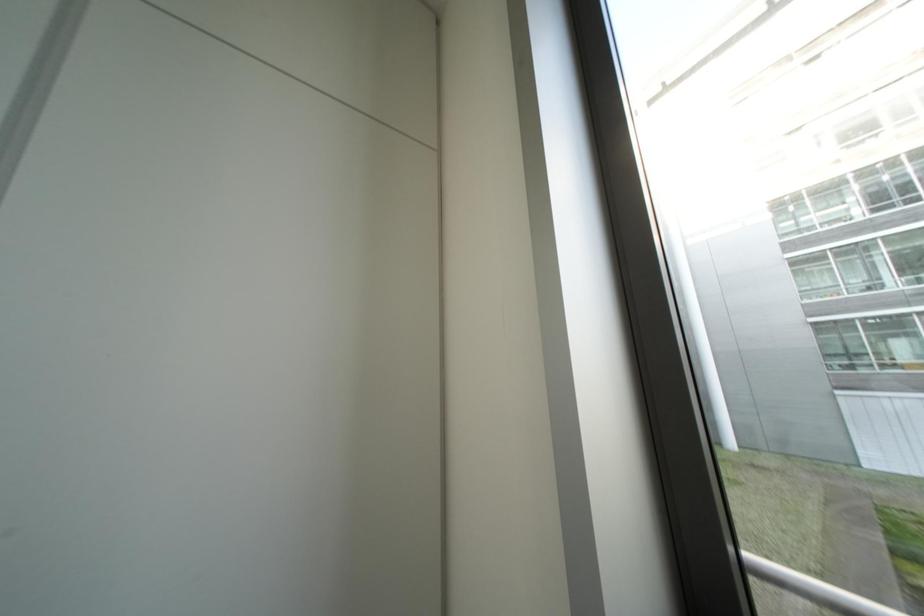
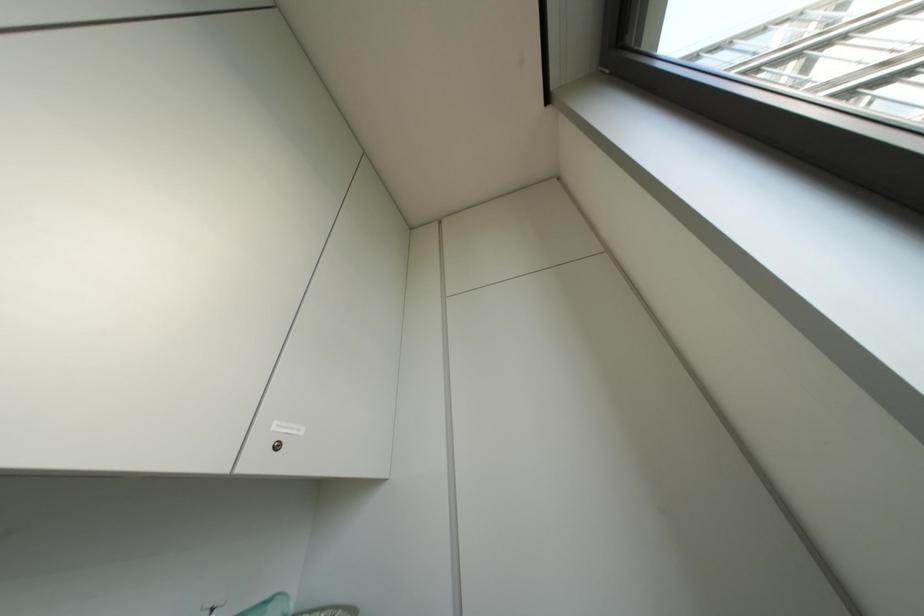
Based on the continuous images, in which direction is the camera rotating?

The camera rotated toward left-up.